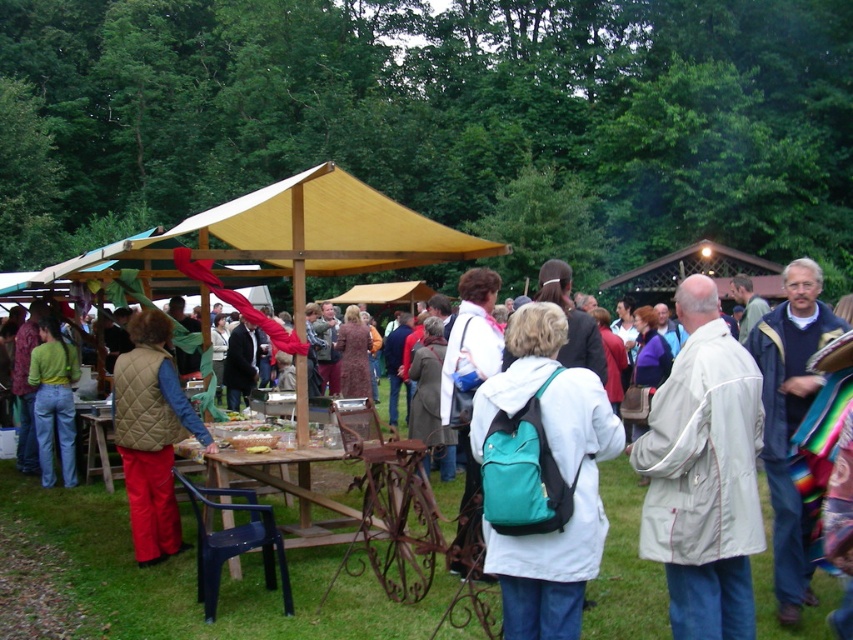
Question: Estimate the real-world distances between objects in this image. Which object is closer to the teal fabric backpack at center?

Choices:
 (A) matte green sweater at left
 (B) light beige fabric jacket at center-right

Answer: (B)

Question: Is teal fabric backpack at center in front of light beige fabric jacket at center-right?

Choices:
 (A) no
 (B) yes

Answer: (B)

Question: Does quilted beige vest at center appear on the left side of matte green sweater at left?

Choices:
 (A) yes
 (B) no

Answer: (B)

Question: Which object is positioned farthest from the quilted beige vest at center?

Choices:
 (A) light beige fabric jacket at center-right
 (B) teal fabric backpack at center
 (C) matte green sweater at left

Answer: (A)

Question: Can you confirm if light beige fabric jacket at center-right is positioned to the right of matte green sweater at left?

Choices:
 (A) no
 (B) yes

Answer: (B)

Question: Which object appears farthest from the camera in this image?

Choices:
 (A) light beige fabric jacket at center-right
 (B) matte green sweater at left
 (C) quilted beige vest at center
 (D) teal fabric backpack at center

Answer: (B)